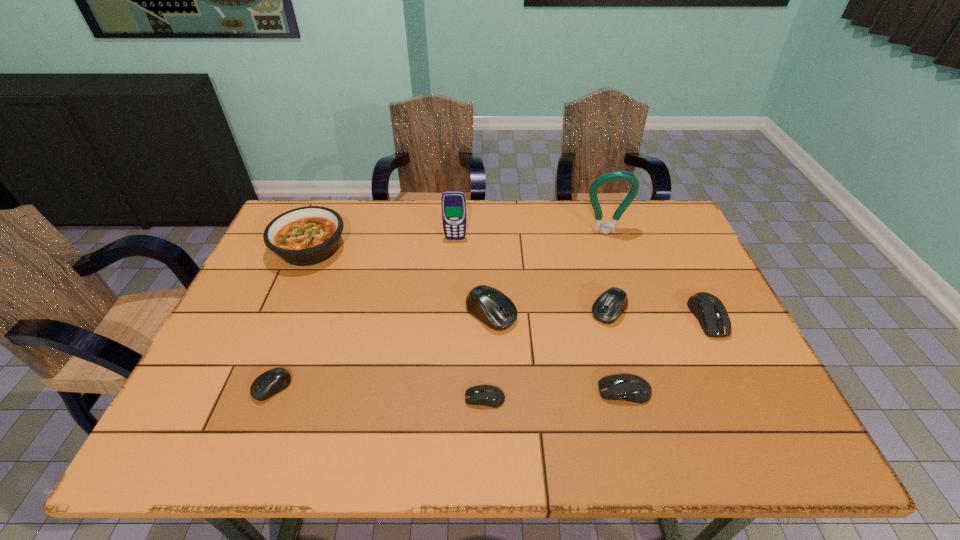
Locate an element on the screen. The height and width of the screenshot is (540, 960). the second biggest dark computer equipment is located at coordinates (627, 387).

Locate an element on the screen. the smallest black mouse is located at coordinates (271, 382).

Identify the location of the leftmost computer equipment. The height and width of the screenshot is (540, 960). (271, 382).

Where is `the shortest computer equipment`? the shortest computer equipment is located at coordinates (487, 395).

Where is `the leftmost dark computer equipment`? The image size is (960, 540). the leftmost dark computer equipment is located at coordinates (487, 395).

Where is `vacant area located 0.130m at the jaws of the tallest object`? Image resolution: width=960 pixels, height=540 pixels. vacant area located 0.130m at the jaws of the tallest object is located at coordinates (616, 265).

Image resolution: width=960 pixels, height=540 pixels. Identify the location of blank space located on the front-facing side of the cellular telephone. (451, 300).

The width and height of the screenshot is (960, 540). I want to click on vacant region located on the right of the stew, so click(x=442, y=248).

This screenshot has width=960, height=540. What are the coordinates of `free location located 0.100m on the back of the sixth shortest object` in the screenshot? It's located at (491, 271).

You are a GUI agent. You are given a task and a screenshot of the screen. Output one action in this format:
    pyautogui.click(x=<x>, y=<y>)
    Task: Click on the vacant space located 0.180m on the back of the rightmost black mouse
    
    Given the screenshot: What is the action you would take?
    pyautogui.click(x=593, y=253)